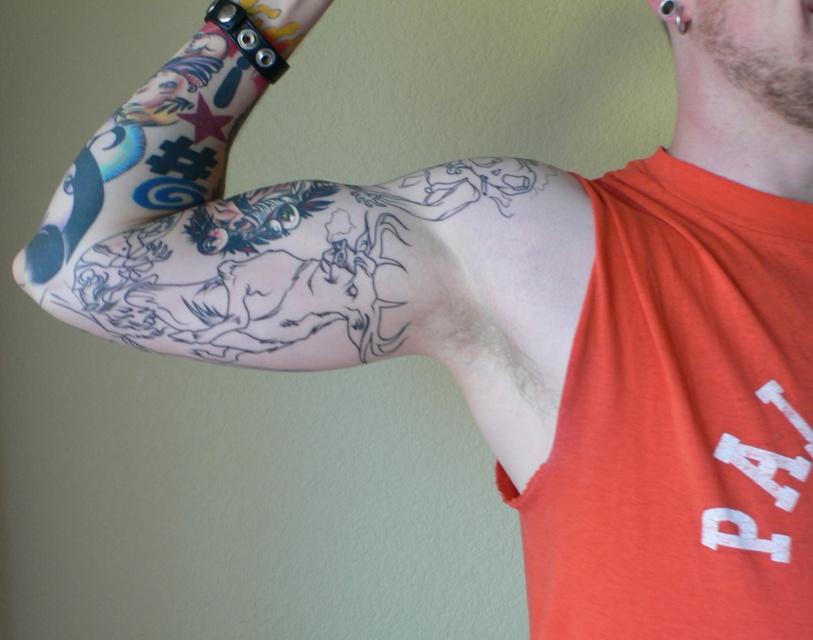
You are a fashion designer analyzing the image of an arm with tattoos. You need to place a small accessory exactly at the position of the orange cotton tank top at upper right. What are the coordinates where you should place the accessory?

The orange cotton tank top at upper right is located at coordinates point (680, 420), so you should place the accessory there.

You are a tattoo artist planning to add a new tattoo to the arm shown in the image. The new tattoo must be placed at point (680, 420). However, you notice that this point is already covered by an object. What object is located at this point?

The orange cotton tank top at upper right is located at point (680, 420).

Based on the photo, you are a tattoo artist assessing the placement of a new tattoo. You see the orange cotton tank top at upper right and the black ink tattoo at upper left. Which item is closer to the viewer?

The orange cotton tank top at upper right is closer to the viewer because it is in front of the black ink tattoo at upper left.